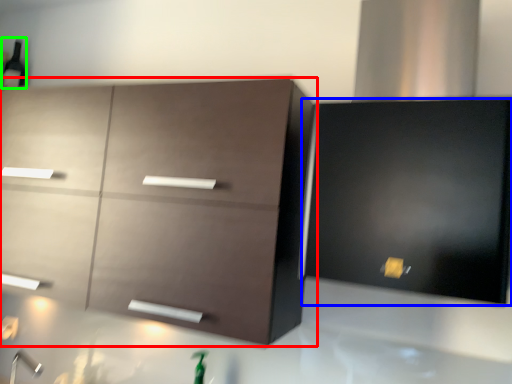
Question: Which object is positioned farthest from cabinetry (highlighted by a red box)? Select from cabinetry (highlighted by a blue box) and beer bottle (highlighted by a green box).

Choices:
 (A) cabinetry
 (B) beer bottle

Answer: (B)